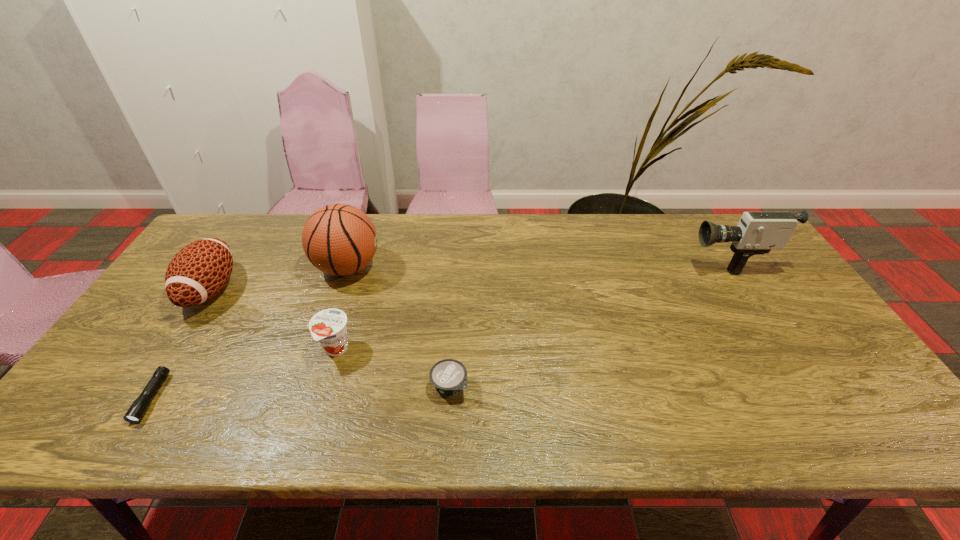
Image resolution: width=960 pixels, height=540 pixels. I want to click on vacant region located on the recording direction of the rightmost object, so click(651, 258).

This screenshot has height=540, width=960. Find the location of `free space located on the recording direction of the rightmost object`. free space located on the recording direction of the rightmost object is located at coordinates (582, 258).

Where is `free region located 0.170m on the back of the football`? This screenshot has width=960, height=540. free region located 0.170m on the back of the football is located at coordinates (251, 229).

The height and width of the screenshot is (540, 960). I want to click on free space located on the right of the farther yogurt, so click(447, 349).

Find the location of `free space located 0.090m on the left of the second shortest object`. free space located 0.090m on the left of the second shortest object is located at coordinates (393, 387).

Locate an element on the screen. basketball situated at the far edge is located at coordinates (339, 239).

Where is `camcorder that is at the far edge`? The width and height of the screenshot is (960, 540). camcorder that is at the far edge is located at coordinates [757, 233].

You are a GUI agent. You are given a task and a screenshot of the screen. Output one action in this format:
    pyautogui.click(x=<x>, y=<y>)
    Task: Click on the object present at the near edge
    Image resolution: width=960 pixels, height=540 pixels.
    Given the screenshot: What is the action you would take?
    pyautogui.click(x=137, y=410)

Where is `football present at the left edge`? This screenshot has width=960, height=540. football present at the left edge is located at coordinates (199, 271).

Where is `flashlight located at the left edge`? The height and width of the screenshot is (540, 960). flashlight located at the left edge is located at coordinates (137, 410).